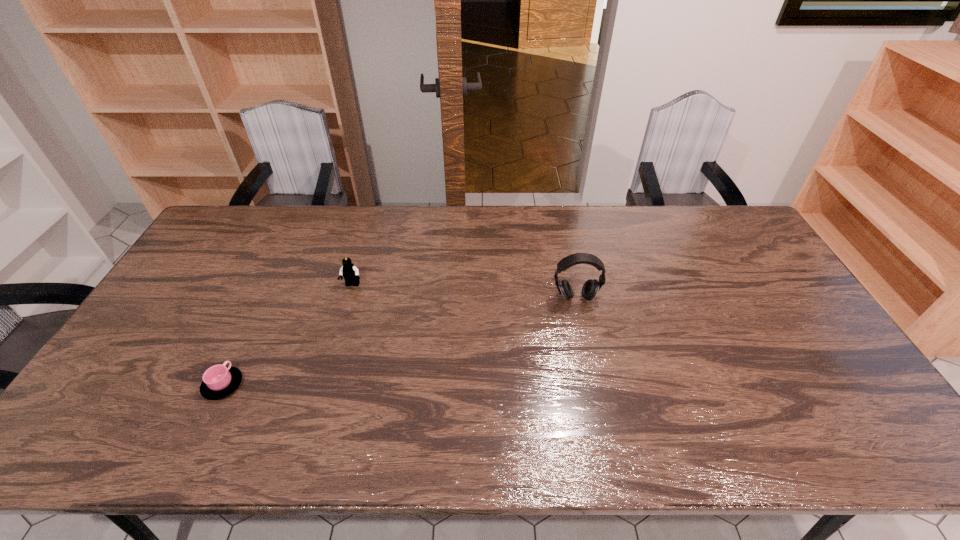
This screenshot has height=540, width=960. Identify the location of the rightmost object. (590, 288).

Locate an element on the screen. This screenshot has height=540, width=960. the second nearest object is located at coordinates (590, 288).

The width and height of the screenshot is (960, 540). I want to click on the second tallest object, so click(350, 273).

Where is `Lego`? The image size is (960, 540). Lego is located at coordinates (350, 273).

This screenshot has width=960, height=540. What are the coordinates of `the shortest object` in the screenshot? It's located at (219, 381).

Find the location of a particular element. cup is located at coordinates (219, 381).

What are the coordinates of `free space located on the ear cups of the rightmost object` in the screenshot? It's located at (582, 329).

This screenshot has height=540, width=960. What are the coordinates of `blank space located 0.290m on the front-facing side of the Lego` in the screenshot? It's located at coord(327,368).

What are the coordinates of `vacant space located 0.110m on the side with the handle of the shortest object` in the screenshot? It's located at (247, 336).

This screenshot has height=540, width=960. In order to click on free space located on the side with the handle of the shortest object in this screenshot , I will do `click(270, 288)`.